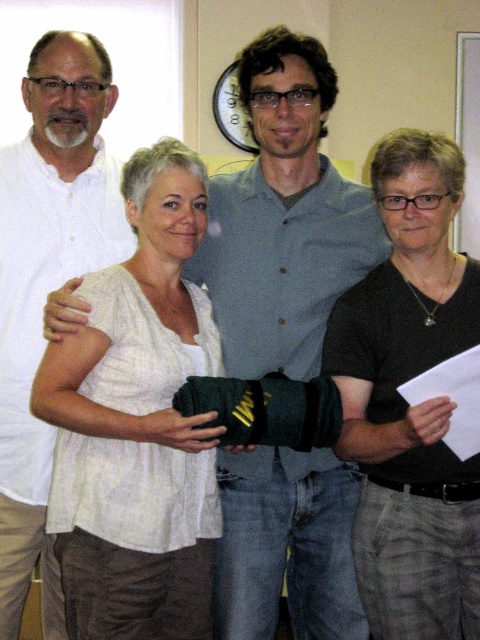
Which is more to the right, white textured shirt at center or matte white board at upper right?

From the viewer's perspective, matte white board at upper right appears more on the right side.

Which is behind, point (179, 506) or point (468, 244)?

The point (468, 244) is more distant.

Image resolution: width=480 pixels, height=640 pixels. In order to click on white textured shirt at center in this screenshot , I will do `click(137, 422)`.

Between matte black shirt at center and white textured shirt at center, which one is positioned higher?

Positioned higher is matte black shirt at center.

Who is shorter, matte black shirt at center or white textured shirt at center?

With less height is matte black shirt at center.

Between point (235, 566) and point (104, 444), which one is positioned behind?

The point (235, 566) is more distant.

At what (x,y) coordinates should I click in order to perform the action: click on matte black shirt at center. Please return your answer as a coordinate pair (x, y). Image resolution: width=480 pixels, height=640 pixels. Looking at the image, I should click on (284, 218).

Image resolution: width=480 pixels, height=640 pixels. What are the coordinates of `white cotton shirt at left` in the screenshot? It's located at (47, 284).

Is the position of white cotton shirt at left less distant than that of matte white board at upper right?

Yes, it is in front of matte white board at upper right.

This screenshot has height=640, width=480. Identify the location of white cotton shirt at left. (47, 284).